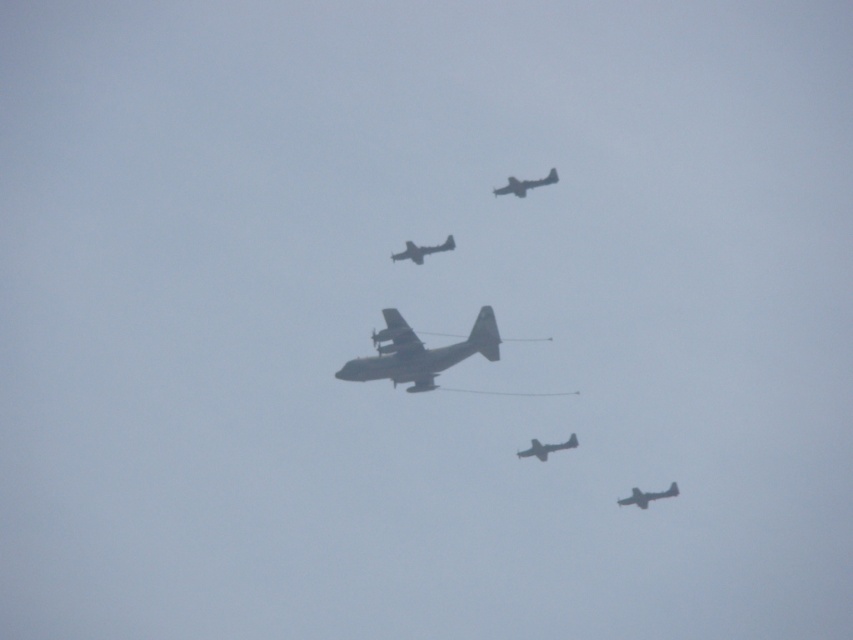
You are a pilot in one of the smaller aircraft being towed by the central transport plane. You notice two points in the sky ahead of you at coordinates point [450,237] and point [511,179]. Which point is closer to your current position?

Point [511,179] is closer to your current position because it is in front of point [450,237], which is behind it.

You are a pilot observing the formation of aircraft. You need to determine which airplane is more prominent in the formation. Which one is bigger between the metallic gray airplane at center and the matte gray airplane at upper center?

The metallic gray airplane at center has a larger size compared to the matte gray airplane at upper center, so it is more prominent in the formation.

You are a pilot flying a small aircraft and need to navigate between two points in the sky. The first point is point [393,385] and the second point is point [535,186]. If you are approaching from the direction of the larger aircraft, which point should you reach first?

Point [393,385] is in front of point [535,186], so you should reach point [393,385] first when approaching from the direction of the larger aircraft.